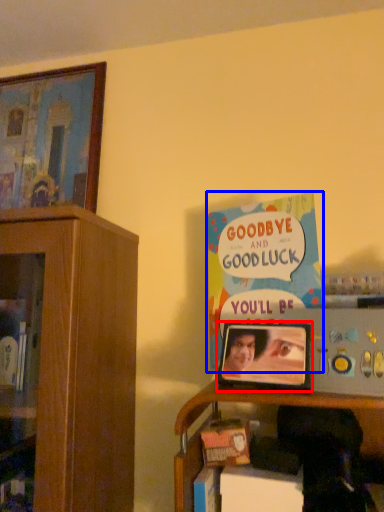
Question: Among these objects, which one is nearest to the camera, picture frame (highlighted by a red box) or book (highlighted by a blue box)?

Choices:
 (A) picture frame
 (B) book

Answer: (A)